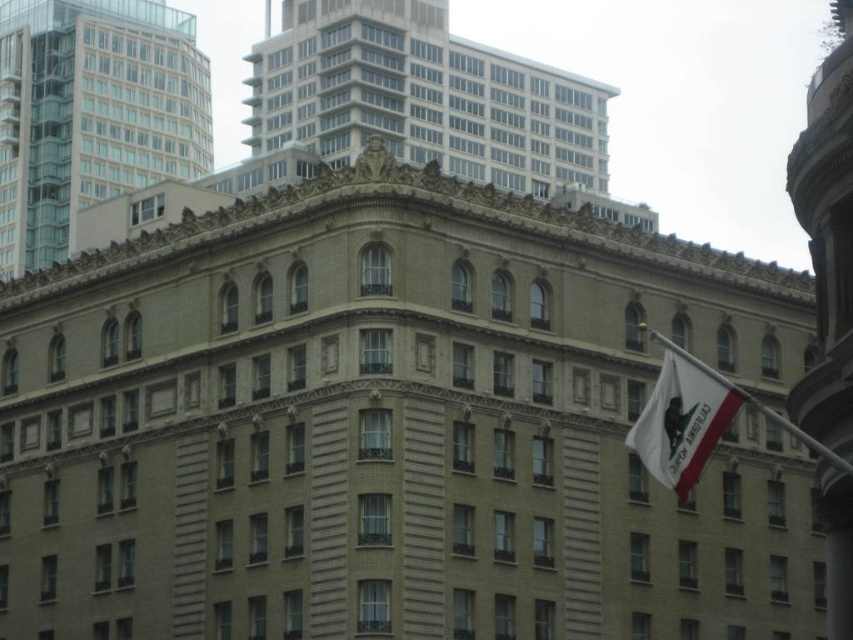
Question: Is smooth concrete building at upper center below white fabric flag at right?

Choices:
 (A) yes
 (B) no

Answer: (B)

Question: Is smooth concrete building at upper center bigger than smooth glass windows at upper left?

Choices:
 (A) no
 (B) yes

Answer: (B)

Question: Which of these objects is positioned closest to the smooth glass windows at upper left?

Choices:
 (A) smooth concrete building at upper center
 (B) white fabric flag at right

Answer: (A)

Question: Can you confirm if smooth concrete building at upper center is thinner than smooth glass windows at upper left?

Choices:
 (A) no
 (B) yes

Answer: (A)

Question: Among these points, which one is farthest from the camera?

Choices:
 (A) tap(511, 188)
 (B) tap(109, 13)

Answer: (B)

Question: Which point is farther to the camera?

Choices:
 (A) smooth concrete building at upper center
 (B) smooth glass windows at upper left
 (C) white fabric flag at right

Answer: (B)